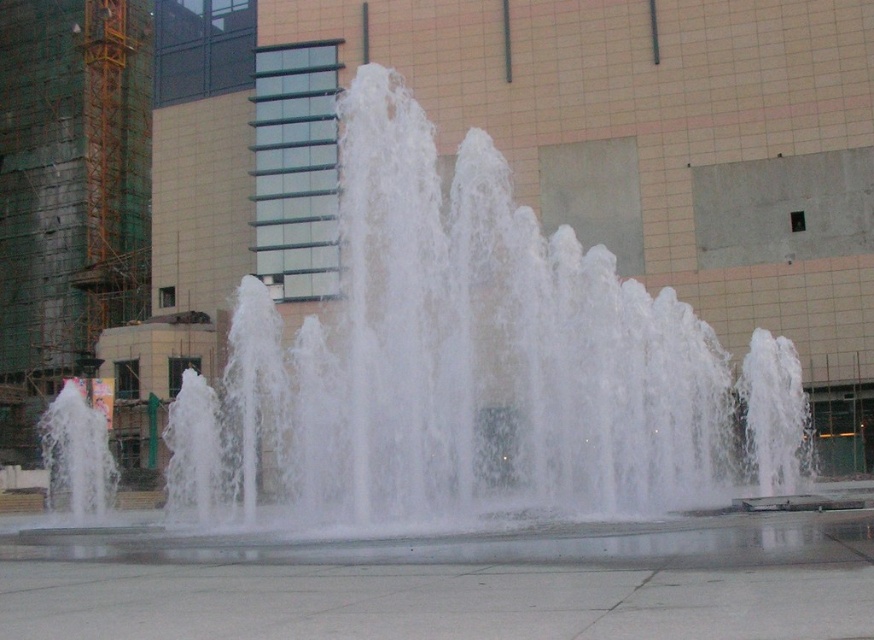
Between white frothy water at center and gray concrete pavement at center, which one is positioned higher?

white frothy water at center is higher up.

Is white frothy water at center taller than gray concrete pavement at center?

Indeed, white frothy water at center has a greater height compared to gray concrete pavement at center.

Locate an element on the screen. The height and width of the screenshot is (640, 874). white frothy water at center is located at coordinates (456, 378).